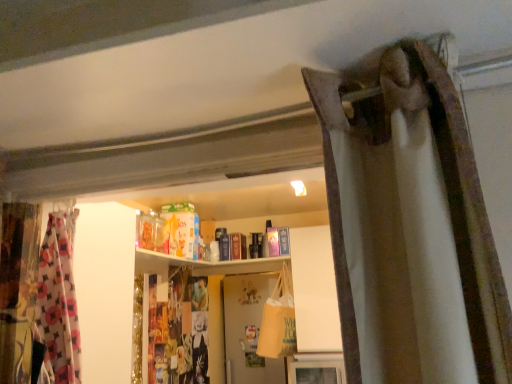
The width and height of the screenshot is (512, 384). What do you see at coordinates (246, 325) in the screenshot?
I see `matte yellow screen door at center` at bounding box center [246, 325].

Identify the location of matte yellow screen door at center. (246, 325).

Where is `matte yellow screen door at center`? This screenshot has width=512, height=384. matte yellow screen door at center is located at coordinates [x=246, y=325].